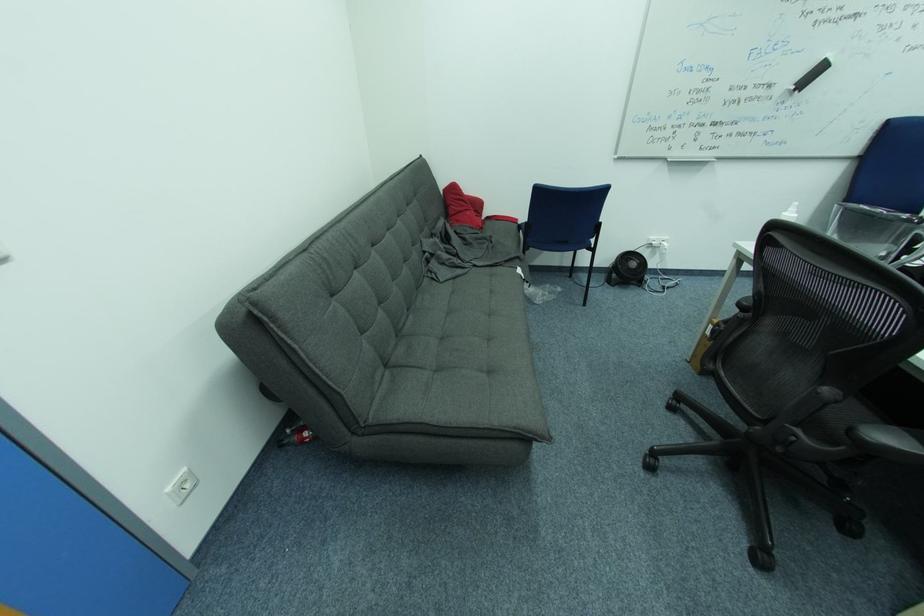
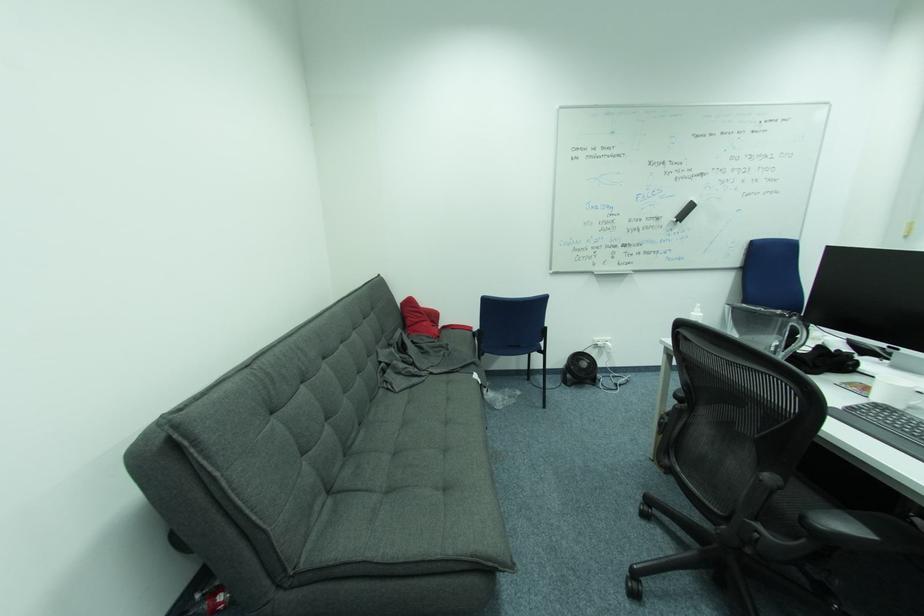
Question: The images are taken continuously from a first-person perspective. In which direction is your viewpoint rotating?

Choices:
 (A) Left
 (B) Right
 (C) Up
 (D) Down

Answer: (C)